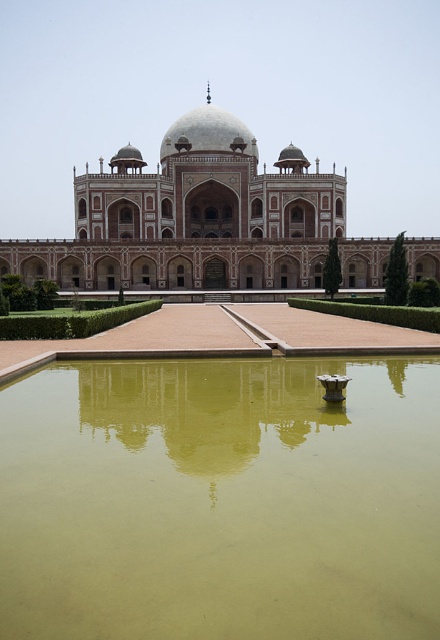
Consider the image. Can you confirm if green murky water at center is positioned below white marble palace at center?

Indeed, green murky water at center is positioned under white marble palace at center.

You are a GUI agent. You are given a task and a screenshot of the screen. Output one action in this format:
    pyautogui.click(x=<x>, y=<y>)
    Task: Click on the green murky water at center
    The width and height of the screenshot is (440, 640).
    Given the screenshot: What is the action you would take?
    pyautogui.click(x=220, y=500)